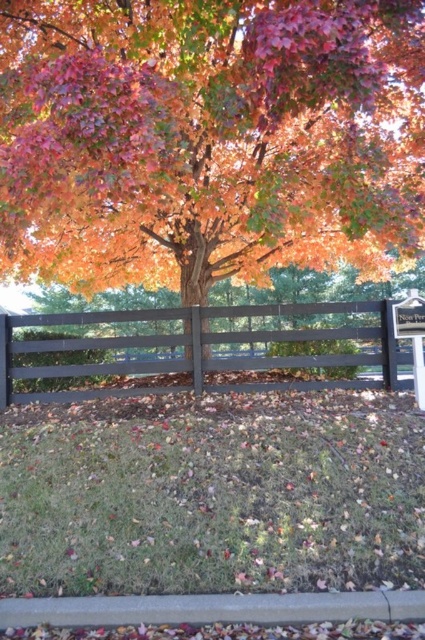
Question: Does autumn leaves at center appear over smooth dark brown fence at center?

Choices:
 (A) yes
 (B) no

Answer: (A)

Question: Is autumn leaves at center bigger than smooth dark brown fence at center?

Choices:
 (A) no
 (B) yes

Answer: (B)

Question: Which object is closer to the camera taking this photo?

Choices:
 (A) autumn leaves at center
 (B) smooth dark brown fence at center

Answer: (A)

Question: Can you confirm if autumn leaves at center is wider than smooth dark brown fence at center?

Choices:
 (A) yes
 (B) no

Answer: (A)

Question: Which point appears closest to the camera in this image?

Choices:
 (A) (240, 83)
 (B) (136, 392)

Answer: (A)

Question: Which point is farther to the camera?

Choices:
 (A) (385, 353)
 (B) (73, 268)

Answer: (B)